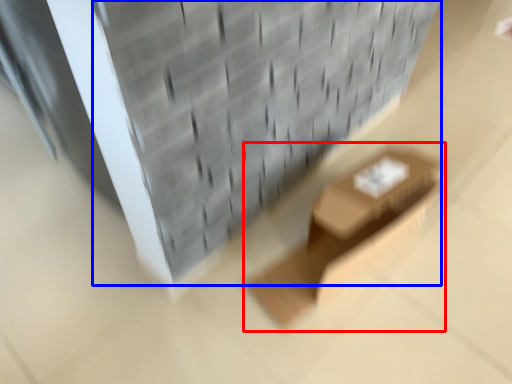
Question: Which object appears farthest to the camera in this image, furniture (highlighted by a red box) or brickwork (highlighted by a blue box)?

Choices:
 (A) furniture
 (B) brickwork

Answer: (A)